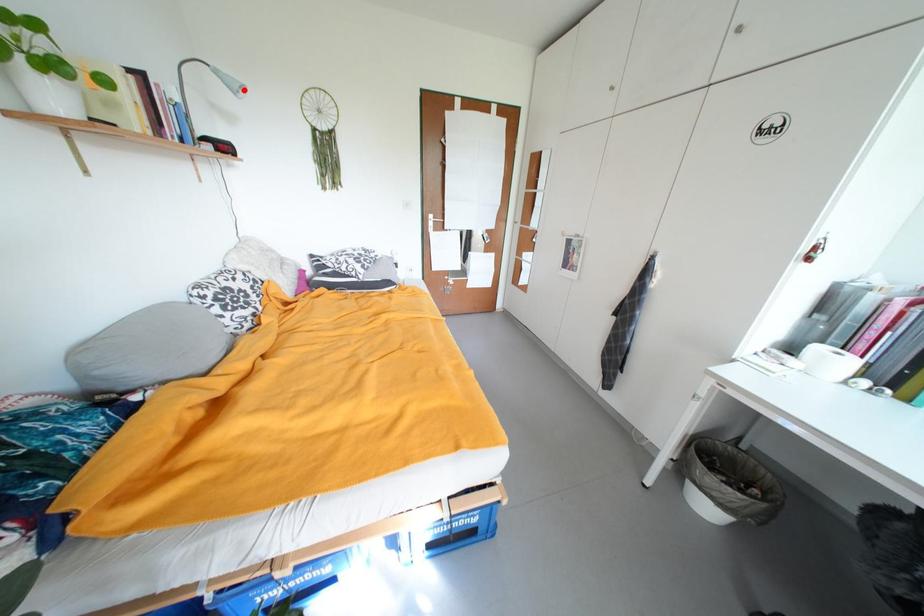
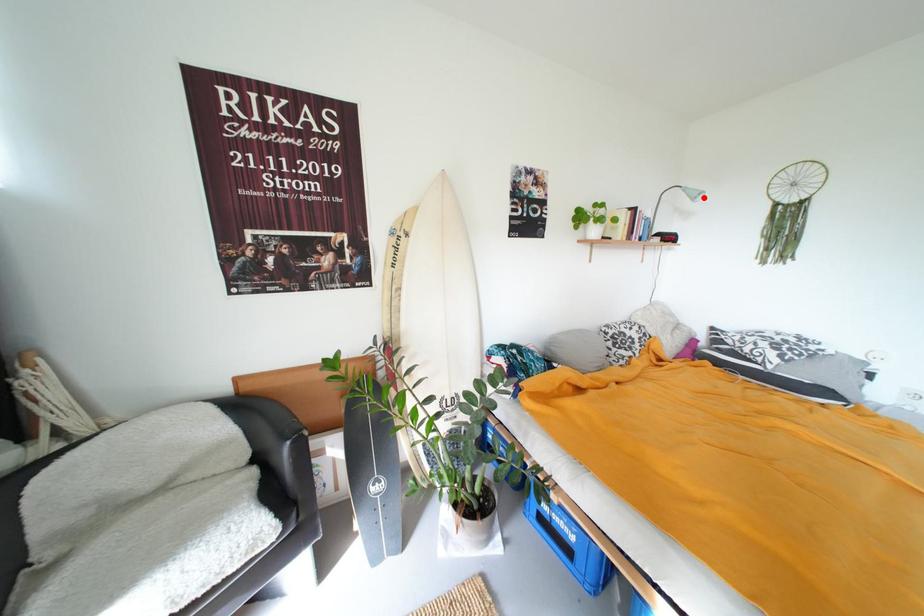
I am providing you with two images of the same scene from different viewpoints. A red point is marked on the first image and another point is marked on the second image. Are the points marked in image1 and image2 representing the same 3D position?

Yes